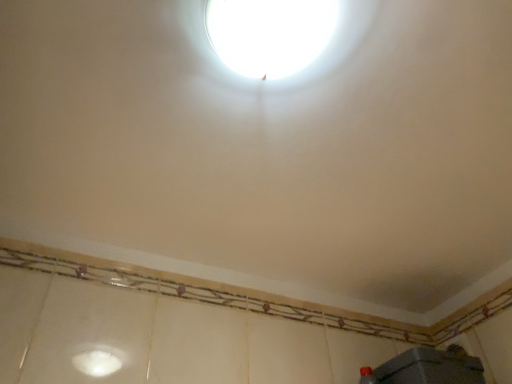
What is the approximate height of white glossy light fixture at upper center?

The height of white glossy light fixture at upper center is 1.70 inches.

Find the location of a particular element. Image resolution: width=512 pixels, height=384 pixels. white glossy light fixture at upper center is located at coordinates (269, 34).

This screenshot has height=384, width=512. Describe the element at coordinates (269, 34) in the screenshot. I see `white glossy light fixture at upper center` at that location.

The width and height of the screenshot is (512, 384). Find the location of `white glossy light fixture at upper center`. white glossy light fixture at upper center is located at coordinates (269, 34).